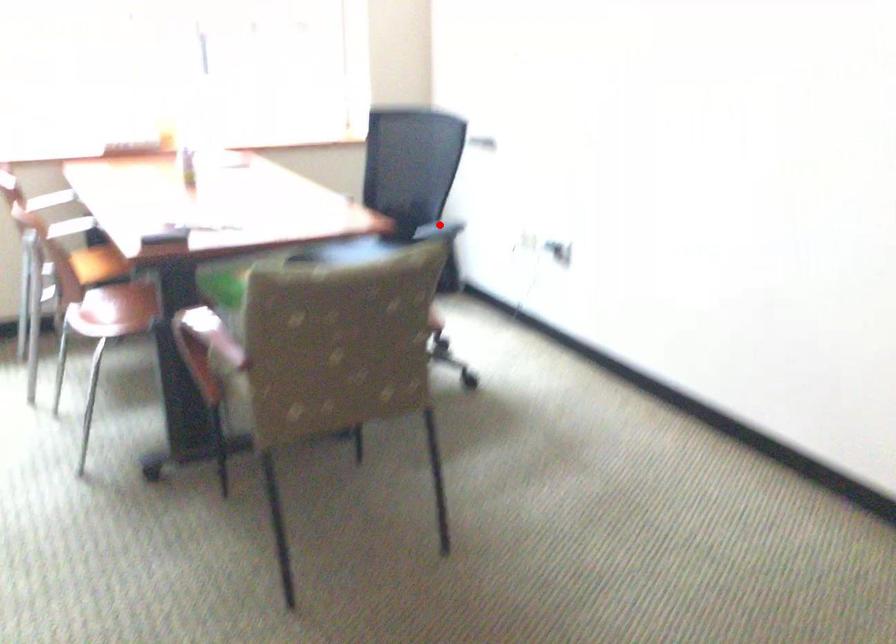
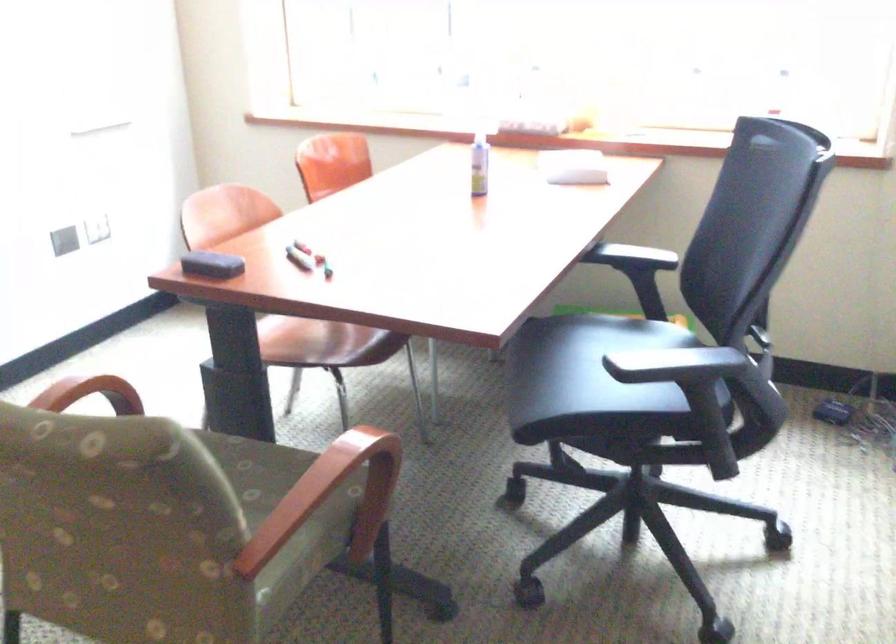
Question: A red point is marked in image1. In image2, is the corresponding 3D point closer to the camera or farther? Reply with the corresponding letter.

Choices:
 (A) The corresponding 3D point is closer.
 (B) The corresponding 3D point is farther.

Answer: (A)